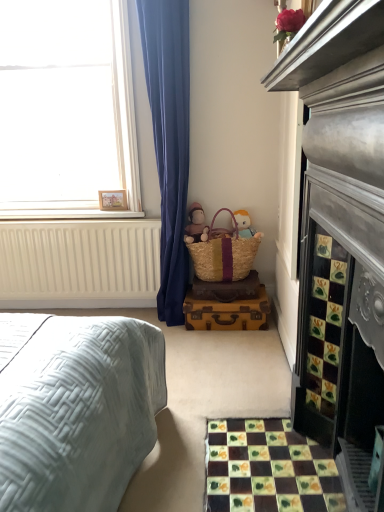
Question: Is beige wicker basket at center far from matte pink plush at center?

Choices:
 (A) no
 (B) yes

Answer: (A)

Question: Considering the relative positions of beige wicker basket at center and matte pink plush at center in the image provided, is beige wicker basket at center to the right of matte pink plush at center from the viewer's perspective?

Choices:
 (A) no
 (B) yes

Answer: (B)

Question: Does beige wicker basket at center appear on the left side of matte pink plush at center?

Choices:
 (A) no
 (B) yes

Answer: (A)

Question: From a real-world perspective, is beige wicker basket at center positioned under matte pink plush at center based on gravity?

Choices:
 (A) no
 (B) yes

Answer: (B)

Question: Is beige wicker basket at center shorter than matte pink plush at center?

Choices:
 (A) no
 (B) yes

Answer: (A)

Question: Considering the relative sizes of beige wicker basket at center and matte pink plush at center in the image provided, is beige wicker basket at center smaller than matte pink plush at center?

Choices:
 (A) yes
 (B) no

Answer: (A)

Question: Considering the relative sizes of white matte window at upper left and woven straw picnic basket at lower center in the image provided, is white matte window at upper left bigger than woven straw picnic basket at lower center?

Choices:
 (A) no
 (B) yes

Answer: (B)

Question: From a real-world perspective, is white matte window at upper left located higher than woven straw picnic basket at lower center?

Choices:
 (A) yes
 (B) no

Answer: (A)

Question: From the image's perspective, is white matte window at upper left above woven straw picnic basket at lower center?

Choices:
 (A) no
 (B) yes

Answer: (B)

Question: Is white matte window at upper left thinner than woven straw picnic basket at lower center?

Choices:
 (A) no
 (B) yes

Answer: (A)

Question: Is white matte window at upper left to the left of woven straw picnic basket at lower center from the viewer's perspective?

Choices:
 (A) no
 (B) yes

Answer: (B)

Question: Is white matte window at upper left in front of woven straw picnic basket at lower center?

Choices:
 (A) no
 (B) yes

Answer: (B)

Question: Is beige wicker basket at center facing towards multicolored mosaic tiles at lower right?

Choices:
 (A) no
 (B) yes

Answer: (B)